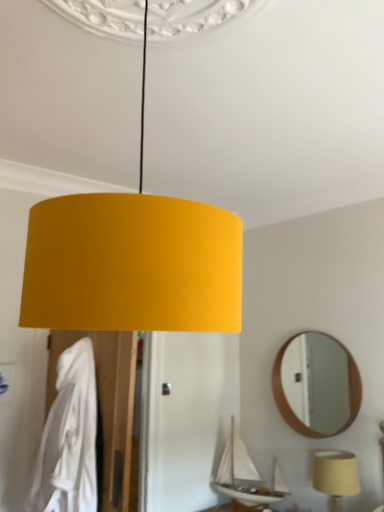
Question: Is white matte sailboat at lower center not near wooden round mirror at upper right?

Choices:
 (A) no
 (B) yes

Answer: (B)

Question: Is white matte sailboat at lower center at the left side of wooden round mirror at upper right?

Choices:
 (A) no
 (B) yes

Answer: (B)

Question: From a real-world perspective, is white matte sailboat at lower center under wooden round mirror at upper right?

Choices:
 (A) no
 (B) yes

Answer: (B)

Question: Considering the relative positions of white matte sailboat at lower center and wooden round mirror at upper right in the image provided, is white matte sailboat at lower center behind wooden round mirror at upper right?

Choices:
 (A) no
 (B) yes

Answer: (B)

Question: Is white matte sailboat at lower center turned away from wooden round mirror at upper right?

Choices:
 (A) no
 (B) yes

Answer: (A)

Question: Considering the relative sizes of white matte sailboat at lower center and wooden round mirror at upper right in the image provided, is white matte sailboat at lower center thinner than wooden round mirror at upper right?

Choices:
 (A) no
 (B) yes

Answer: (A)

Question: Can you confirm if white fabric robe at left is shorter than wooden round mirror at upper right?

Choices:
 (A) yes
 (B) no

Answer: (B)

Question: Is white fabric robe at left surrounding wooden round mirror at upper right?

Choices:
 (A) no
 (B) yes

Answer: (A)

Question: Does white fabric robe at left have a lesser width compared to wooden round mirror at upper right?

Choices:
 (A) no
 (B) yes

Answer: (A)

Question: Is white fabric robe at left looking in the opposite direction of wooden round mirror at upper right?

Choices:
 (A) yes
 (B) no

Answer: (B)

Question: Is white fabric robe at left oriented towards wooden round mirror at upper right?

Choices:
 (A) no
 (B) yes

Answer: (A)

Question: From a real-world perspective, is white fabric robe at left on top of wooden round mirror at upper right?

Choices:
 (A) no
 (B) yes

Answer: (A)

Question: From the image's perspective, is white matte sailboat at lower center above matte beige lampshade at lower right?

Choices:
 (A) yes
 (B) no

Answer: (B)